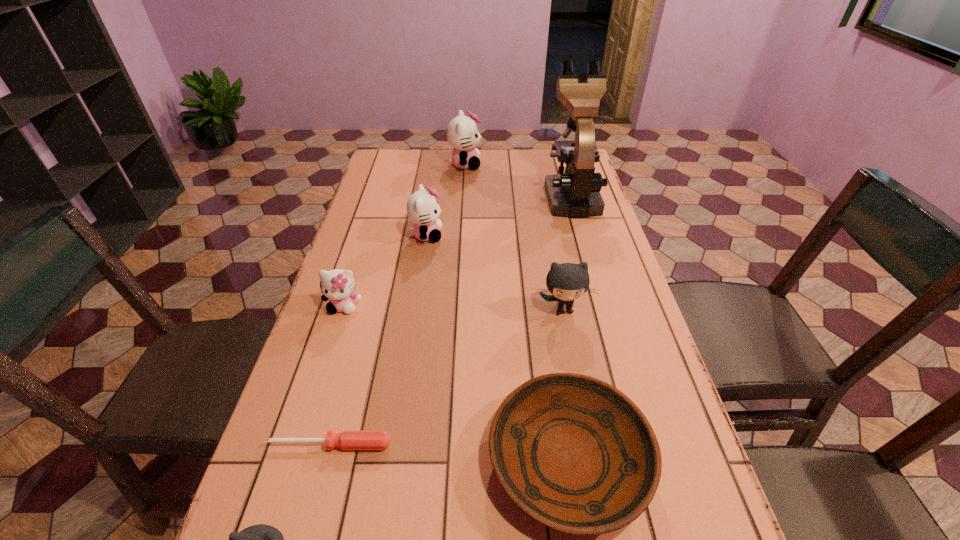
Find the location of a particular element. This screenshot has width=960, height=540. the shortest object is located at coordinates (349, 439).

Locate an element on the screen. Image resolution: width=960 pixels, height=540 pixels. vacant space located 0.220m on the left of the microscope is located at coordinates (481, 195).

The width and height of the screenshot is (960, 540). Find the location of `vacant area situated 0.330m on the front-facing side of the farthest white kitten`. vacant area situated 0.330m on the front-facing side of the farthest white kitten is located at coordinates (568, 164).

Identify the location of blank area located 0.330m on the front-facing side of the second nearest white kitten. (551, 235).

At what (x,y) coordinates should I click in order to perform the action: click on blank area located 0.130m on the front-facing side of the right gray kitten. Please return your answer as a coordinate pair (x, y). The width and height of the screenshot is (960, 540). Looking at the image, I should click on (573, 364).

What are the coordinates of `vacant space located on the front-facing side of the smallest white kitten` in the screenshot? It's located at (301, 438).

Identify the location of vacant space situated 0.290m on the back of the shortest object. This screenshot has height=540, width=960. (363, 325).

The height and width of the screenshot is (540, 960). I want to click on microscope located at the far edge, so click(575, 193).

This screenshot has width=960, height=540. I want to click on kitten that is at the far edge, so click(462, 133).

I want to click on kitten that is at the left edge, so click(337, 285).